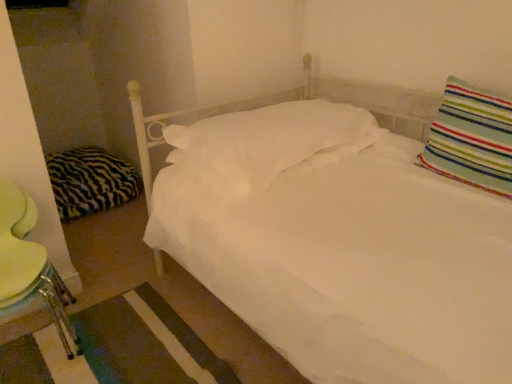
This screenshot has width=512, height=384. I want to click on free point below metallic green swivel chair at lower left (from a real-world perspective), so click(38, 346).